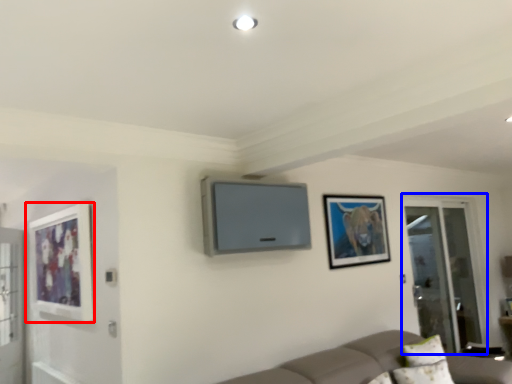
Question: Which object is further to the camera taking this photo, picture frame (highlighted by a red box) or screen door (highlighted by a blue box)?

Choices:
 (A) picture frame
 (B) screen door

Answer: (B)